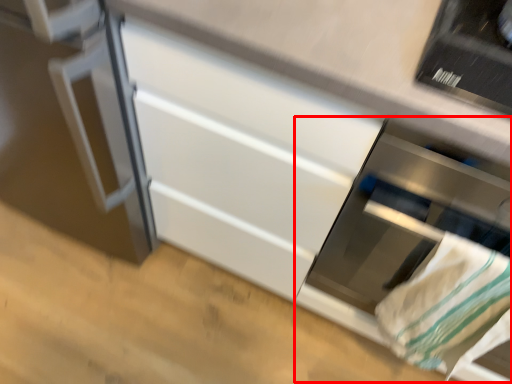
Question: From the image's perspective, where is oven (annotated by the red box) located in relation to blanket in the image?

Choices:
 (A) below
 (B) above

Answer: (B)